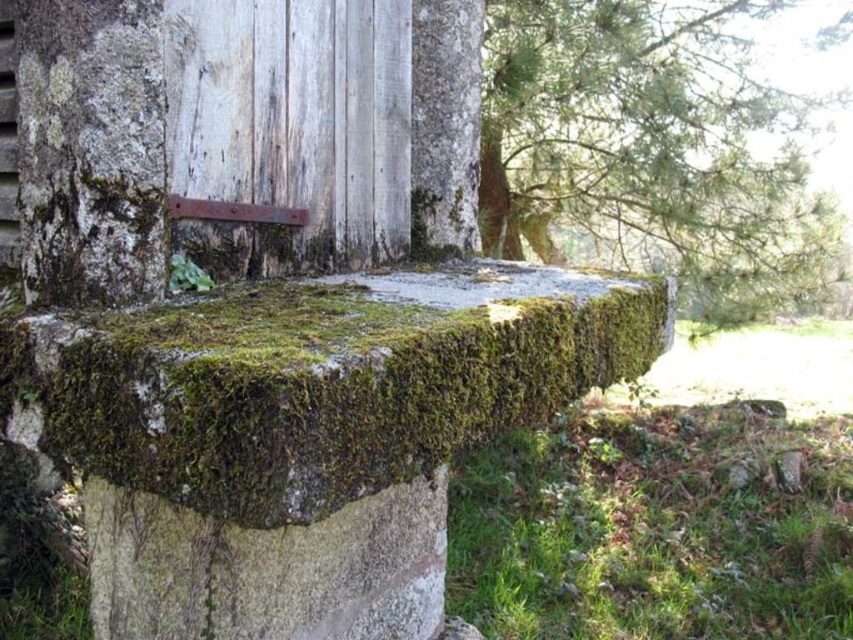
Question: Which of the following is the closest to the observer?

Choices:
 (A) (187, 531)
 (B) (824, 557)

Answer: (A)

Question: Is green mossy stump at upper right below white rough cement at lower center?

Choices:
 (A) no
 (B) yes

Answer: (A)

Question: Among these objects, which one is farthest from the camera?

Choices:
 (A) green mossy stump at upper right
 (B) green mossy grass at lower right

Answer: (A)

Question: In this image, where is green mossy stone at center located relative to green mossy stump at upper right?

Choices:
 (A) right
 (B) left

Answer: (B)

Question: Which point is farther from the camera taking this photo?

Choices:
 (A) (821, 616)
 (B) (193, 637)

Answer: (A)

Question: In this image, where is green mossy grass at lower right located relative to green mossy stump at upper right?

Choices:
 (A) left
 (B) right

Answer: (A)